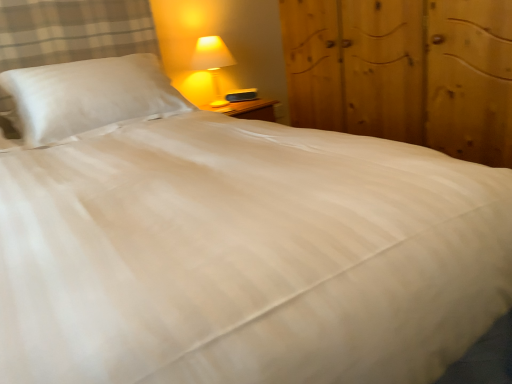
Question: From the image's perspective, relative to white satin pillow at upper left, is wooden dresser at right above or below?

Choices:
 (A) above
 (B) below

Answer: (A)

Question: Relative to white satin pillow at upper left, is wooden dresser at right in front or behind?

Choices:
 (A) front
 (B) behind

Answer: (A)

Question: Which object is positioned closest to the matte yellow plastic lamp at upper right?

Choices:
 (A) wooden dresser at right
 (B) white satin pillow at upper left

Answer: (B)

Question: Estimate the real-world distances between objects in this image. Which object is farther from the matte yellow plastic lamp at upper right?

Choices:
 (A) wooden dresser at right
 (B) white satin pillow at upper left

Answer: (A)